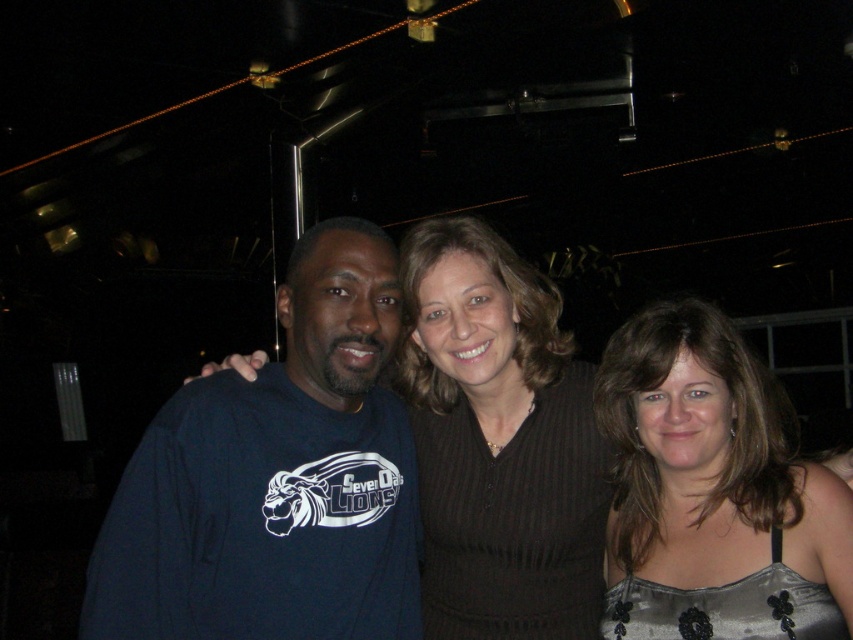
Question: Which point is farther to the camera?

Choices:
 (A) black knitwear at center
 (B) dark blue sweatshirt at left

Answer: (A)

Question: In this image, where is black knitwear at center located relative to silvery satin dress at center?

Choices:
 (A) left
 (B) right

Answer: (A)

Question: Which object is the farthest from the black knitwear at center?

Choices:
 (A) silvery satin dress at center
 (B) dark blue sweatshirt at left

Answer: (B)

Question: Which point appears farthest from the camera in this image?

Choices:
 (A) [244, 506]
 (B) [619, 472]

Answer: (B)

Question: Is dark blue sweatshirt at left to the left of silvery satin dress at center from the viewer's perspective?

Choices:
 (A) no
 (B) yes

Answer: (B)

Question: Does black knitwear at center appear on the left side of silvery satin dress at center?

Choices:
 (A) yes
 (B) no

Answer: (A)